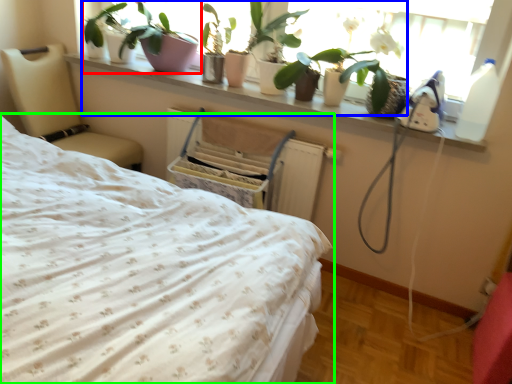
Question: Estimate the real-world distances between objects in this image. Which object is closer to houseplant (highlighted by a red box), plant (highlighted by a blue box) or bed (highlighted by a green box)?

Choices:
 (A) plant
 (B) bed

Answer: (A)